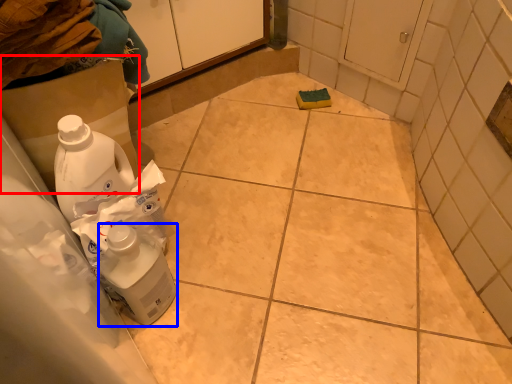
Question: Among these objects, which one is nearest to the camera, cardboard box (highlighted by a red box) or cleaning product (highlighted by a blue box)?

Choices:
 (A) cardboard box
 (B) cleaning product

Answer: (B)